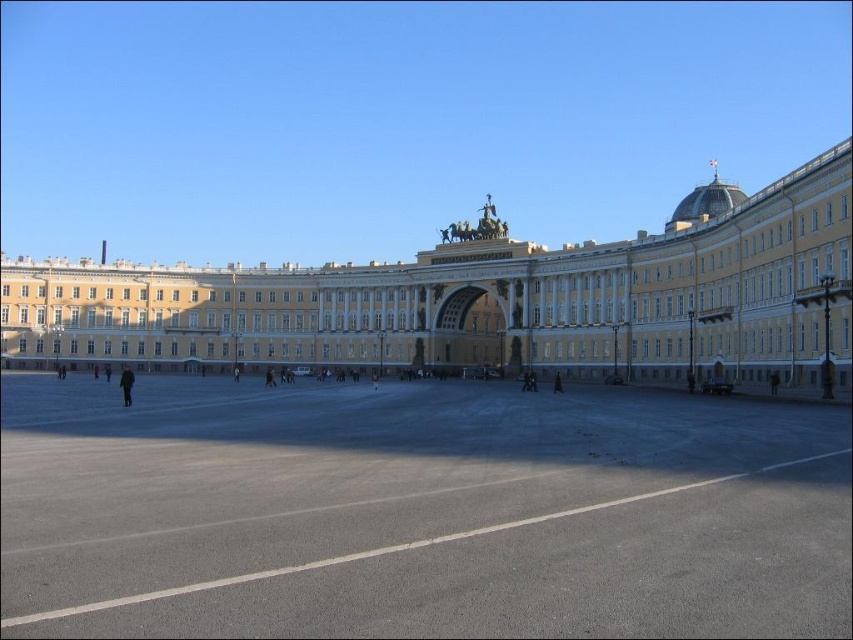
You are standing in front of the grand historical government building. You notice two points marked on the building facade. The first point is at coordinates point (x=169, y=609) and the second is at point (x=519, y=296). From your perspective, which point is closer to you?

Point (x=169, y=609) is in front of point (x=519, y=296), so it is closer to you.

You are a city planner who needs to install a new streetlight between the gray asphalt at center and the white stone building at center. The streetlight requires a minimum of 40 meters of space between the building and the installation point to comply with safety regulations. Can the installation proceed as planned?

The gray asphalt at center is 37.51 meters from the white stone building at center. Since the required distance is 40 meters, the installation cannot proceed as planned because the distance is insufficient.

You are standing on the gray asphalt at center looking up at the white stone building at center. Which object is higher from the ground?

The white stone building at center is higher from the ground than the gray asphalt at center because the gray asphalt at center is below it.